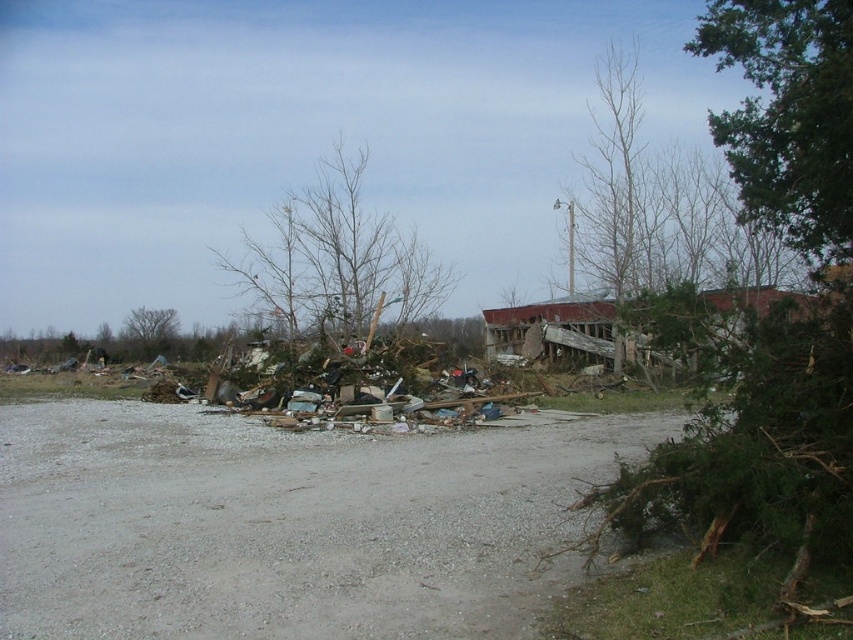
You are a rescue worker trying to reach the green leafy tree at upper right to assess its stability. Given that your drone can fly up to 10 meters, will it be able to reach the tree?

The green leafy tree at upper right is 10.52 meters away from the camera. Since the drone can only fly up to 10 meters, it will not be able to reach the tree.

You are a rescue worker assessing the damage after a storm. You notice the green leafy tree at upper right and the bare wood tree at center. Which tree has a smaller trunk diameter?

The green leafy tree at upper right has a smaller trunk diameter than the bare wood tree at center.

Looking at this image, you are a rescue worker trying to reach a survivor located at point (787, 147). The debris field is 15 meters wide. Can you safely cross the debris field to reach the survivor?

The point (787, 147) is 17.52 meters from the camera, which is beyond the 15 meters width of the debris field. Therefore, you cannot safely cross the debris field to reach the survivor.